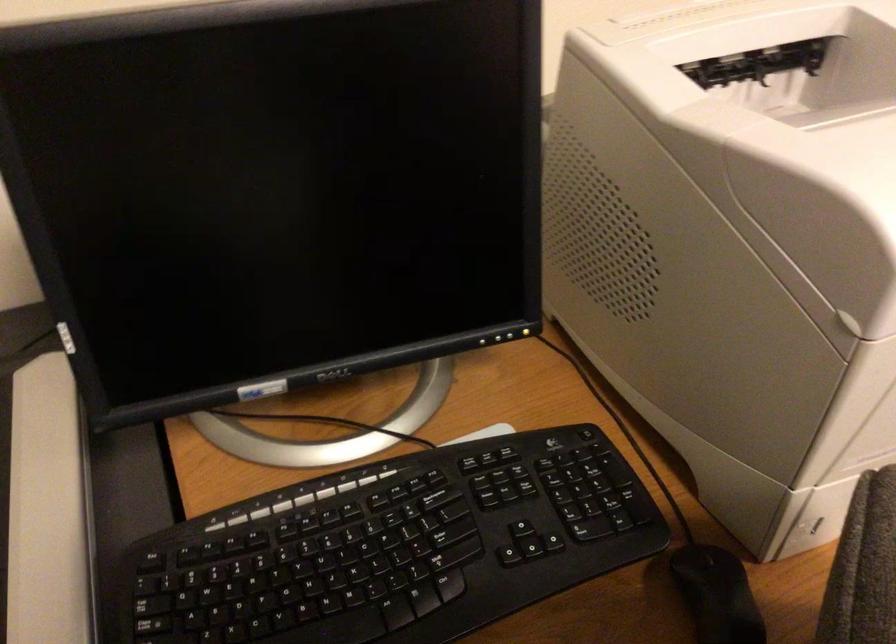
Locate an element on the screen. black computer mouse is located at coordinates (717, 594).